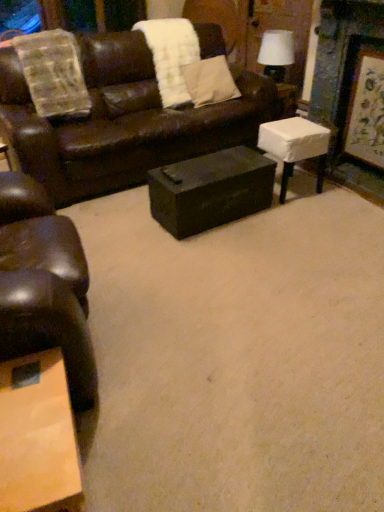
Locate an element on the screen. free point behind shiny brown leather chair at left is located at coordinates (118, 247).